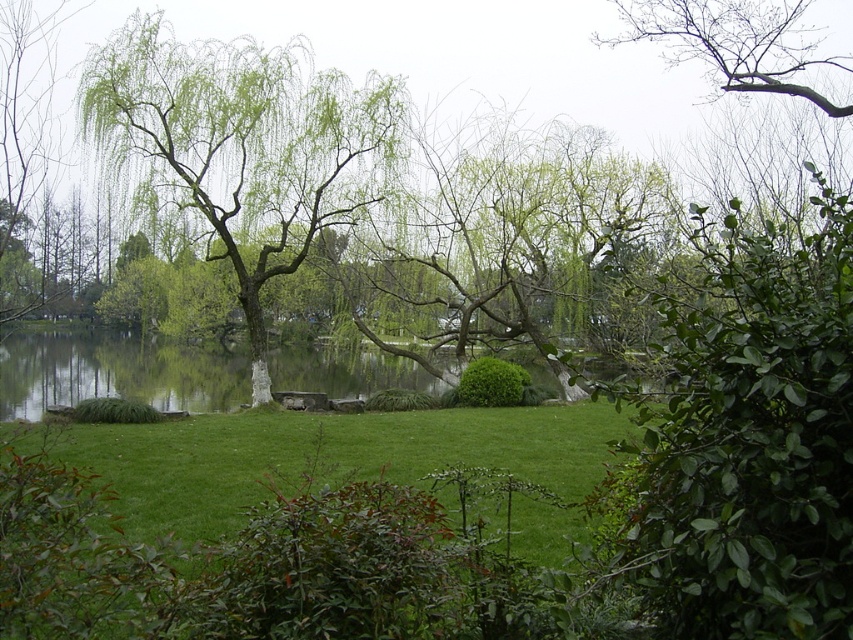
Question: Which of the following is the farthest from the observer?

Choices:
 (A) (56, 360)
 (B) (332, 221)
 (C) (788, 60)

Answer: (A)

Question: Where is green grassy lake at center located in relation to bare branches at upper right in the image?

Choices:
 (A) left
 (B) right

Answer: (A)

Question: Which point is closer to the camera?

Choices:
 (A) (300, 221)
 (B) (763, 22)
 (C) (80, 364)

Answer: (B)

Question: Is green leafy willow at center bigger than bare branches at upper right?

Choices:
 (A) no
 (B) yes

Answer: (A)

Question: Which point appears farthest from the camera in this image?

Choices:
 (A) (136, 109)
 (B) (236, 401)
 (C) (718, 10)

Answer: (B)

Question: Is green leafy willow at center below green grassy lake at center?

Choices:
 (A) no
 (B) yes

Answer: (A)